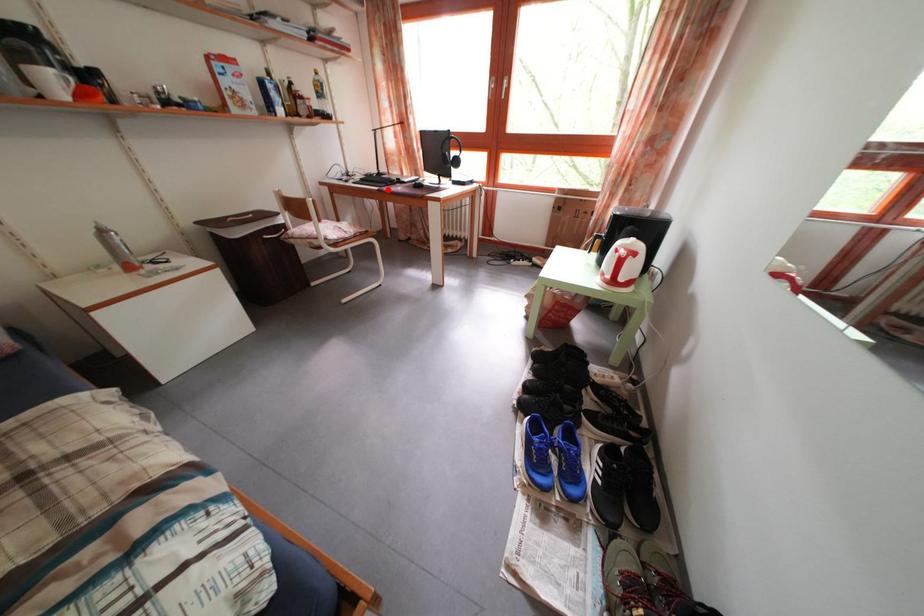
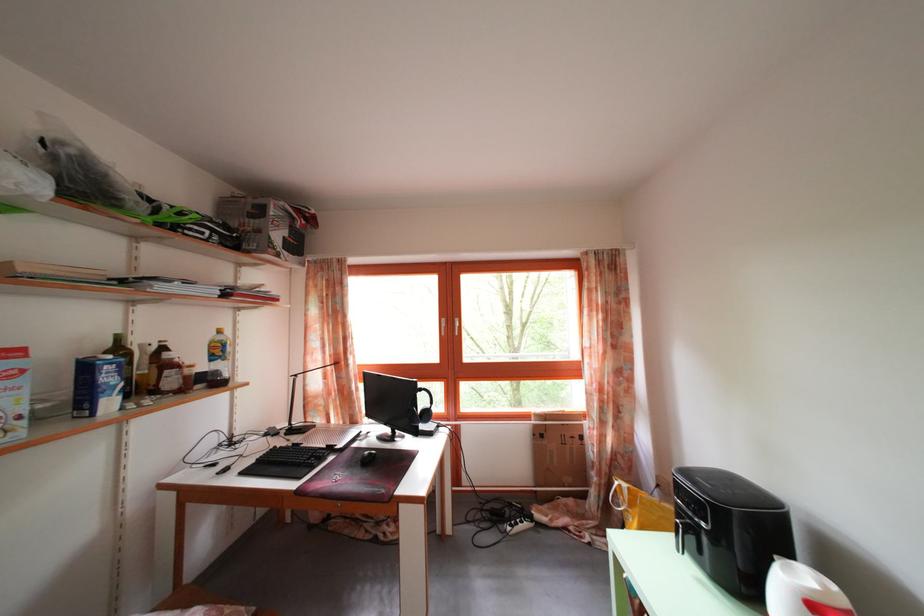
The point at the highlighted location is marked in the first image. Where is the corresponding point in the second image?

(307, 472)